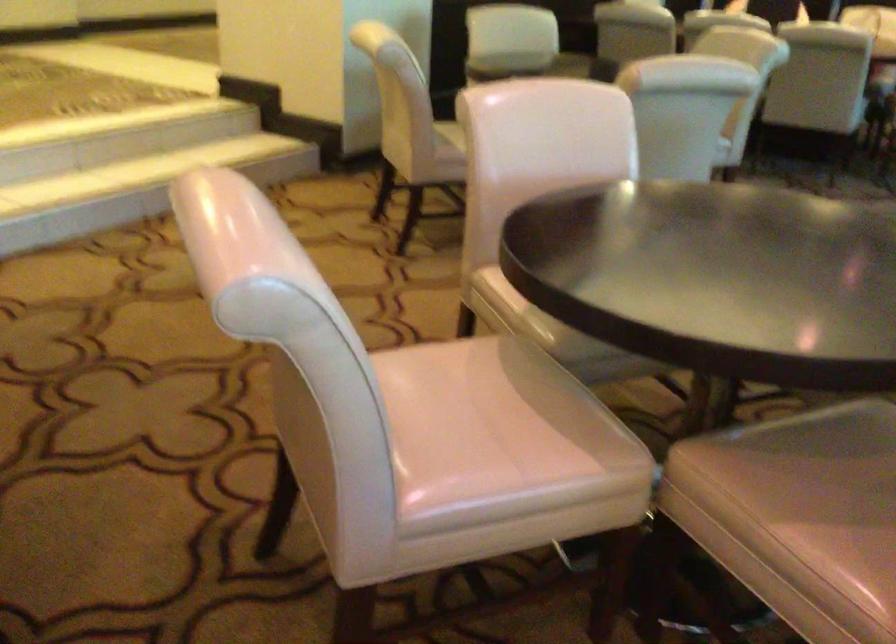
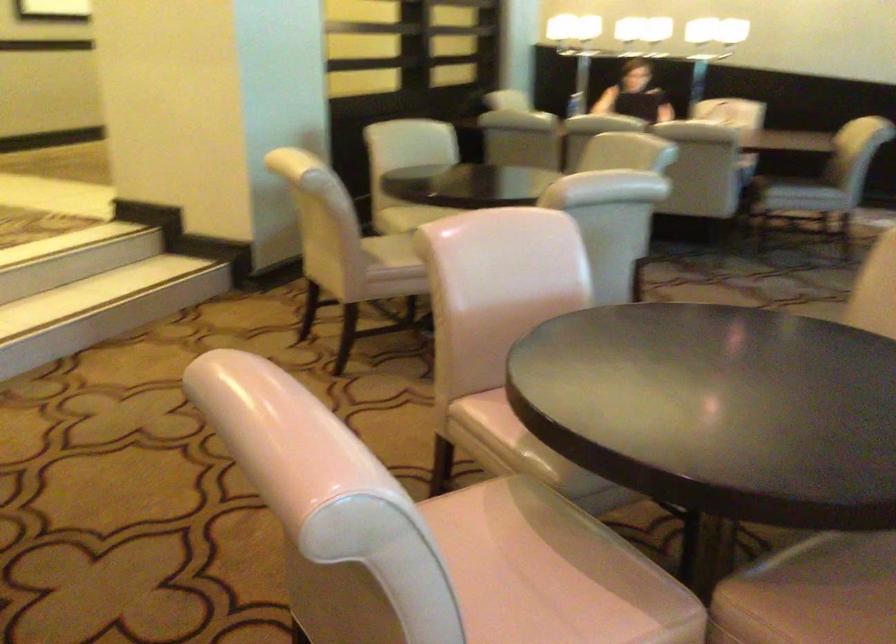
Find the pixel in the second image that matches point (787, 468) in the first image.

(828, 590)